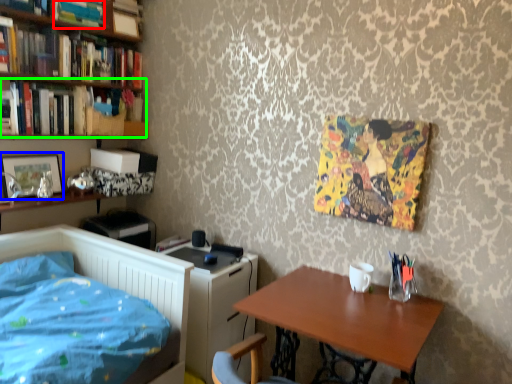
Question: Based on their relative distances, which object is farther from book (highlighted by a red box)? Choose from picture frame (highlighted by a blue box) and book (highlighted by a green box).

Choices:
 (A) picture frame
 (B) book

Answer: (A)